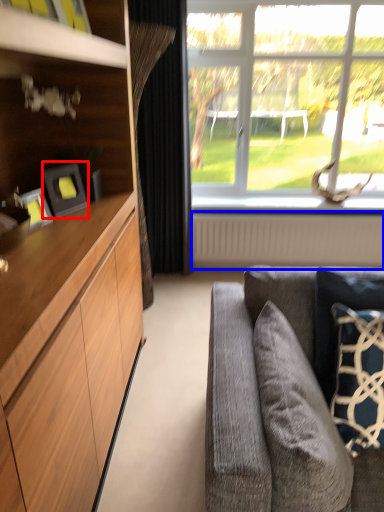
Question: Which object is further to the camera taking this photo, picture frame (highlighted by a red box) or radiator (highlighted by a blue box)?

Choices:
 (A) picture frame
 (B) radiator

Answer: (B)